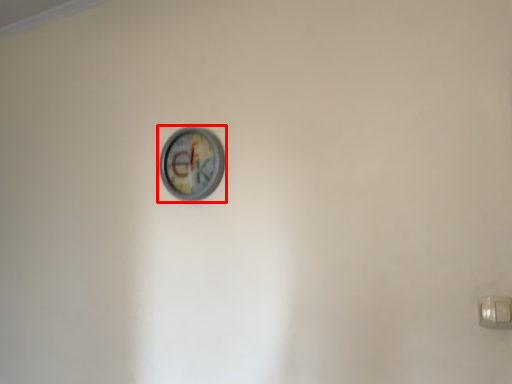
Question: From the image's perspective, where is wall clock (annotated by the red box) located relative to door handle?

Choices:
 (A) above
 (B) below

Answer: (A)